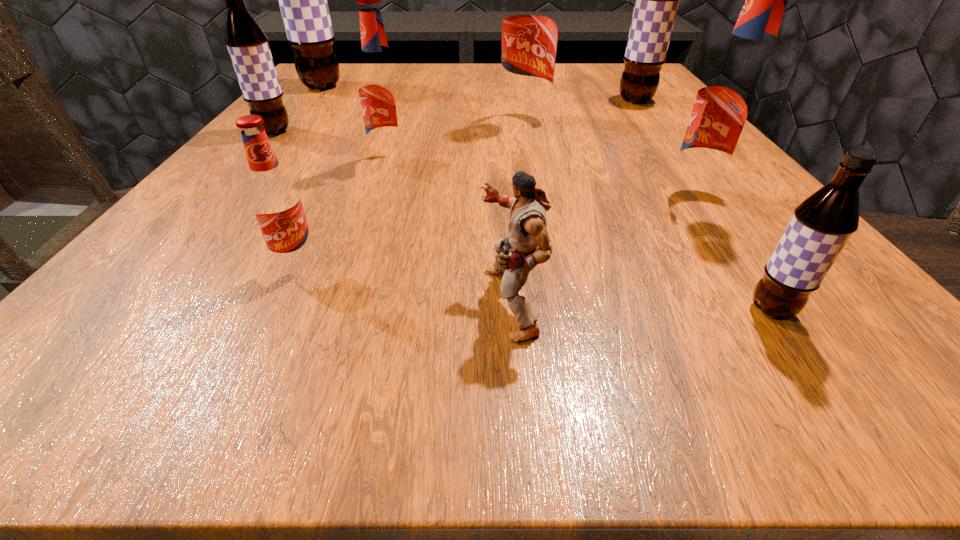
The width and height of the screenshot is (960, 540). I want to click on free area in between the biggest brown root beer and the fifth root beer from left to right, so click(422, 104).

You are a GUI agent. You are given a task and a screenshot of the screen. Output one action in this format:
    pyautogui.click(x=<x>, y=<y>)
    Task: Click on the blank region between the smallest red root beer and the second biggest brown root beer
    
    Given the screenshot: What is the action you would take?
    pyautogui.click(x=467, y=182)

Identify the location of free point between the nearest red root beer and the puncher. The width and height of the screenshot is (960, 540). (404, 283).

What are the coordinates of `free space between the fourth root beer from right to left and the fifth farthest object` in the screenshot? It's located at (457, 141).

At what (x,y) coordinates should I click in order to perform the action: click on object that stands as the fifth closest to the second biggest red root beer. Please return your answer as a coordinate pair (x, y). Looking at the image, I should click on (380, 88).

You are a GUI agent. You are given a task and a screenshot of the screen. Output one action in this format:
    pyautogui.click(x=<x>, y=<y>)
    Task: Click on the object that stands as the third closest to the nearest root beer
    The image size is (960, 540).
    Given the screenshot: What is the action you would take?
    pyautogui.click(x=530, y=20)

Find the location of a particular element. Image resolution: width=960 pixels, height=540 pixels. root beer that stands as the closest to the leftmost red root beer is located at coordinates tap(380, 88).

The image size is (960, 540). What are the coordinates of `the seventh closest root beer relative to the third farthest brown root beer` in the screenshot? It's located at (822, 224).

Locate which brown root beer ranks second in proximity to the second biggest red root beer. Please provide its 2D coordinates. Your answer should be formatted as a tuple, i.e. [(x, y)], where the tuple contains the x and y coordinates of a point satisfying the conditions above.

[(656, 0)]

Choose which brown root beer is the fourth nearest neighbor to the sixth farthest root beer. Please provide its 2D coordinates. Your answer should be formatted as a tuple, i.e. [(x, y)], where the tuple contains the x and y coordinates of a point satisfying the conditions above.

[(303, 3)]